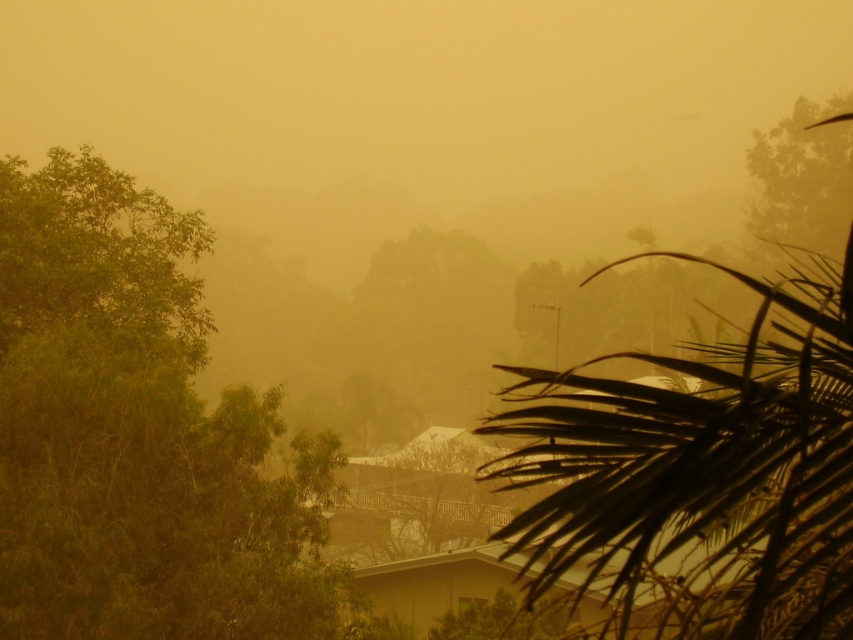
Question: Which of the following is the closest to the observer?

Choices:
 (A) green leafy tree at left
 (B) dark green leafy palm tree at right

Answer: (B)

Question: Which object is closer to the camera taking this photo?

Choices:
 (A) green leafy tree at left
 (B) dark green leafy palm tree at right

Answer: (B)

Question: Does green leafy tree at left have a greater width compared to dark green leafy palm tree at right?

Choices:
 (A) no
 (B) yes

Answer: (A)

Question: In this image, where is green leafy tree at left located relative to dark green leafy palm tree at right?

Choices:
 (A) below
 (B) above

Answer: (A)

Question: Is green leafy tree at left thinner than dark green leafy palm tree at right?

Choices:
 (A) no
 (B) yes

Answer: (B)